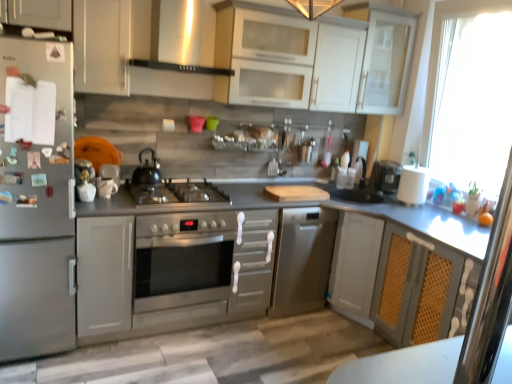
The height and width of the screenshot is (384, 512). In order to click on spots to the right of black matte kettle at center in this screenshot , I will do `click(176, 190)`.